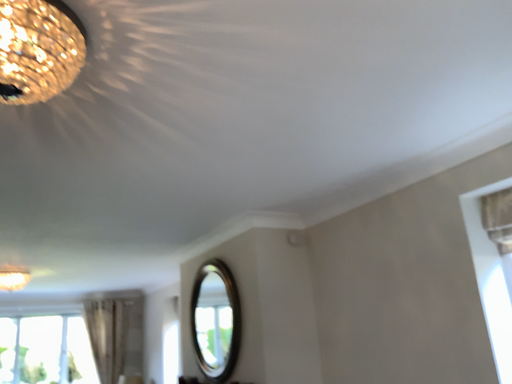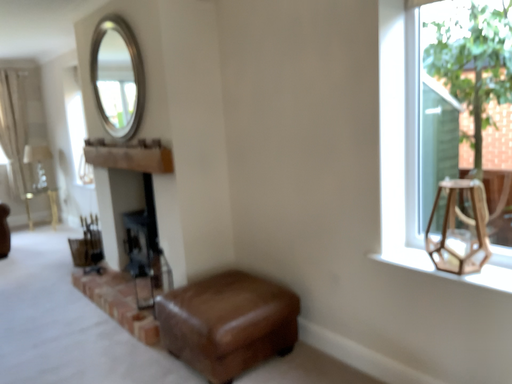
Question: How did the camera likely rotate when shooting the video?

Choices:
 (A) rotated right
 (B) rotated left

Answer: (A)